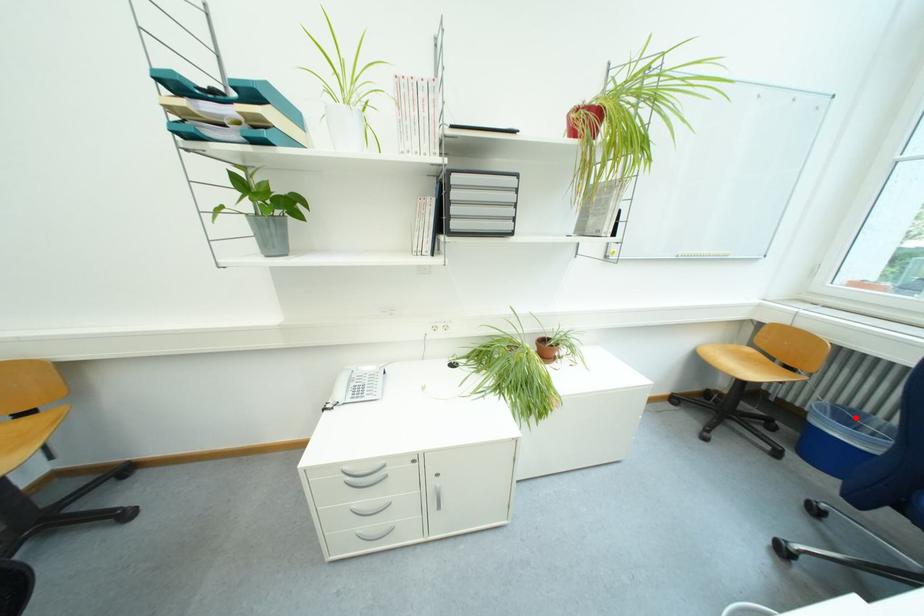
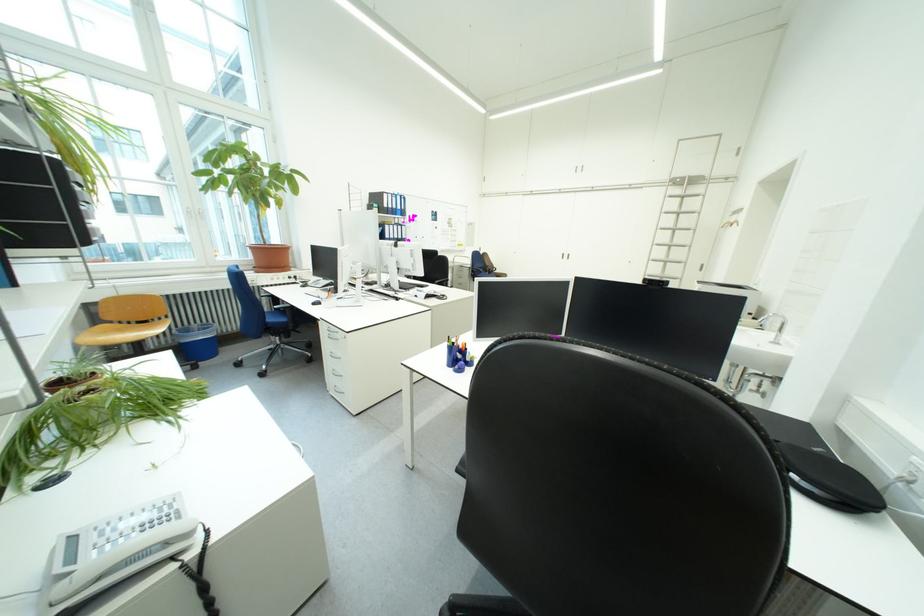
In the second image, find the point that corresponds to the highlighted location in the first image.

(199, 333)